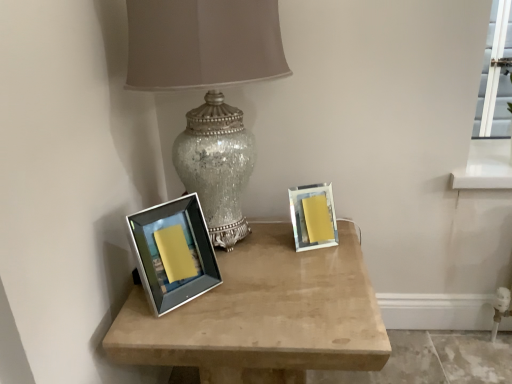
Question: Based on their positions, is silver/metallic picture frame at left, the first picture frame viewed from the front, located to the left or right of matte silver picture frame at right, the 2th picture frame when ordered from front to back?

Choices:
 (A) left
 (B) right

Answer: (A)

Question: Considering the positions of silver/metallic picture frame at left, the second picture frame viewed from the back, and matte silver picture frame at right, which appears as the 2th picture frame when viewed from the left, in the image, is silver/metallic picture frame at left, the second picture frame viewed from the back, wider or thinner than matte silver picture frame at right, which appears as the 2th picture frame when viewed from the left,?

Choices:
 (A) wide
 (B) thin

Answer: (A)

Question: Which object is the farthest from the silver/metallic picture frame at left, the first picture frame viewed from the front?

Choices:
 (A) satin silver frame at center
 (B) matte silver picture frame at right, the 2th picture frame when ordered from front to back
 (C) crackle glass lamp at center

Answer: (B)

Question: Estimate the real-world distances between objects in this image. Which object is closer to the silver/metallic picture frame at left, which appears as the 2th picture frame when viewed from the right?

Choices:
 (A) satin silver frame at center
 (B) crackle glass lamp at center
 (C) matte silver picture frame at right, the first picture frame viewed from the back

Answer: (A)